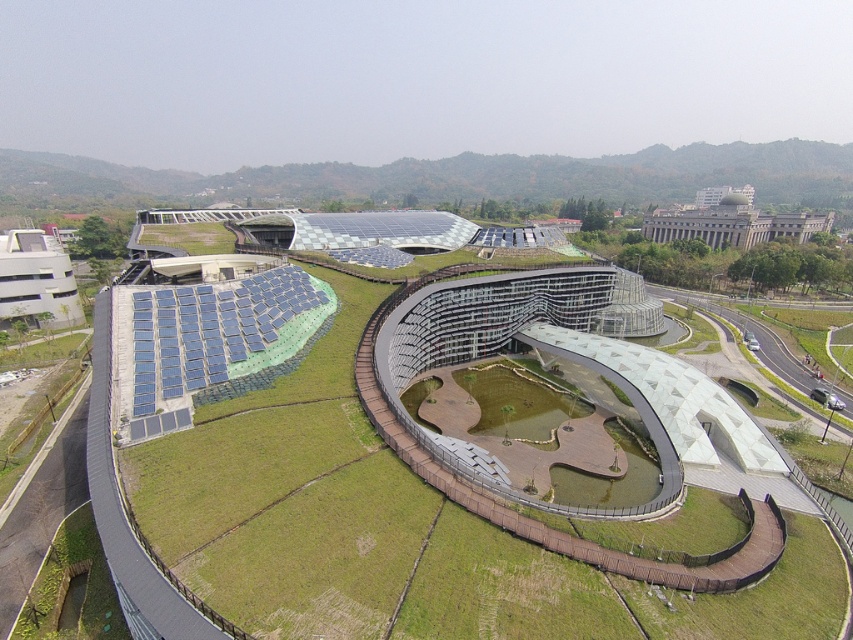
Does point (56, 284) lie in front of point (718, 218)?

Yes, it is in front of point (718, 218).

I want to click on white concrete parking garage at upper left, so click(36, 280).

Which is behind, point (57, 262) or point (711, 221)?

Point (711, 221)

Identify the location of white concrete parking garage at upper left. (36, 280).

Can you confirm if green grass at center is positioned above white concrete parking garage at upper left?

No, green grass at center is not above white concrete parking garage at upper left.

Identify the location of green grass at center. (196, 339).

Is green grass at center below gray concrete building at upper right?

Yes, green grass at center is below gray concrete building at upper right.

Who is positioned more to the right, green grass at center or gray concrete building at upper right?

Positioned to the right is gray concrete building at upper right.

Where is `green grass at center`? green grass at center is located at coordinates (196, 339).

Locate an element on the screen. The width and height of the screenshot is (853, 640). green grass at center is located at coordinates (196, 339).